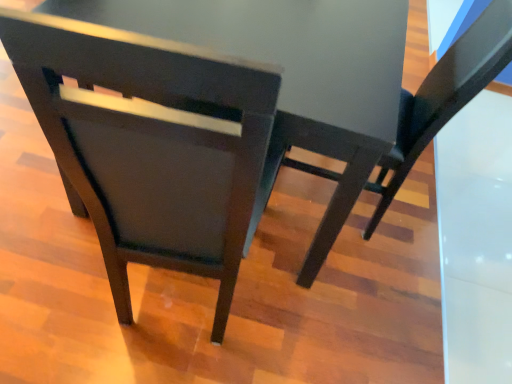
Locate an element on the screen. The width and height of the screenshot is (512, 384). matte black chair at center, positioned as the second chair in left-to-right order is located at coordinates (444, 97).

What do you see at coordinates (444, 97) in the screenshot? I see `matte black chair at center, acting as the first chair starting from the right` at bounding box center [444, 97].

Describe the element at coordinates (150, 144) in the screenshot. I see `matte black chair at center, which is counted as the 1th chair, starting from the left` at that location.

Where is `matte black chair at center, which is the 2th chair from right to left`? The height and width of the screenshot is (384, 512). matte black chair at center, which is the 2th chair from right to left is located at coordinates (150, 144).

Identify the location of matte black chair at center, acting as the first chair starting from the right. (444, 97).

Considering the positions of objects matte black chair at center, which is the 2th chair from right to left, and matte black chair at center, acting as the first chair starting from the right, in the image provided, who is more to the right, matte black chair at center, which is the 2th chair from right to left, or matte black chair at center, acting as the first chair starting from the right,?

Positioned to the right is matte black chair at center, acting as the first chair starting from the right.

Is the position of matte black chair at center, which is the 2th chair from right to left, less distant than that of matte black chair at center, acting as the first chair starting from the right?

Yes, the depth of matte black chair at center, which is the 2th chair from right to left, is less than that of matte black chair at center, acting as the first chair starting from the right.

Does point (132, 248) come behind point (407, 141)?

No, it is in front of (407, 141).

From the image's perspective, is matte black chair at center, which is counted as the 1th chair, starting from the left, positioned above or below matte black chair at center, positioned as the second chair in left-to-right order?

From the image's perspective, matte black chair at center, which is counted as the 1th chair, starting from the left, appears below matte black chair at center, positioned as the second chair in left-to-right order.

From a real-world perspective, is matte black chair at center, which is the 2th chair from right to left, above or below matte black chair at center, acting as the first chair starting from the right?

In terms of real-world spatial position, matte black chair at center, which is the 2th chair from right to left, is above matte black chair at center, acting as the first chair starting from the right.

Which of these two, matte black chair at center, which is the 2th chair from right to left, or matte black chair at center, positioned as the second chair in left-to-right order, is wider?

matte black chair at center, positioned as the second chair in left-to-right order, is wider.

Who is shorter, matte black chair at center, which is the 2th chair from right to left, or matte black chair at center, positioned as the second chair in left-to-right order?

matte black chair at center, positioned as the second chair in left-to-right order, is shorter.

Is matte black chair at center, which is counted as the 1th chair, starting from the left, bigger or smaller than matte black chair at center, positioned as the second chair in left-to-right order?

matte black chair at center, which is counted as the 1th chair, starting from the left, is bigger than matte black chair at center, positioned as the second chair in left-to-right order.

Do you think matte black chair at center, which is the 2th chair from right to left, is within matte black chair at center, acting as the first chair starting from the right, or outside of it?

matte black chair at center, which is the 2th chair from right to left, cannot be found inside matte black chair at center, acting as the first chair starting from the right.

Is matte black chair at center, which is counted as the 1th chair, starting from the left, not close to matte black chair at center, positioned as the second chair in left-to-right order?

No, there isn't a large distance between matte black chair at center, which is counted as the 1th chair, starting from the left, and matte black chair at center, positioned as the second chair in left-to-right order.

Is matte black chair at center, which is the 2th chair from right to left, turned away from matte black chair at center, acting as the first chair starting from the right?

matte black chair at center, which is the 2th chair from right to left, does not have its back to matte black chair at center, acting as the first chair starting from the right.

This screenshot has width=512, height=384. Find the location of `chair directly beneath the matte black chair at center, which is the 2th chair from right to left (from a real-world perspective)`. chair directly beneath the matte black chair at center, which is the 2th chair from right to left (from a real-world perspective) is located at coordinates (444, 97).

Does matte black chair at center, acting as the first chair starting from the right, appear on the right side of matte black chair at center, which is counted as the 1th chair, starting from the left?

Yes.

Is the depth of matte black chair at center, acting as the first chair starting from the right, less than that of matte black chair at center, which is the 2th chair from right to left?

No, matte black chair at center, acting as the first chair starting from the right, is further to the viewer.

Between point (445, 69) and point (60, 44), which one is positioned behind?

The point (445, 69) is farther from the camera.

From the image's perspective, which object appears higher, matte black chair at center, positioned as the second chair in left-to-right order, or matte black chair at center, which is the 2th chair from right to left?

matte black chair at center, positioned as the second chair in left-to-right order, is shown above in the image.

In the scene shown: From a real-world perspective, who is located lower, matte black chair at center, positioned as the second chair in left-to-right order, or matte black chair at center, which is the 2th chair from right to left?

From a 3D spatial view, matte black chair at center, positioned as the second chair in left-to-right order, is below.

In terms of width, does matte black chair at center, positioned as the second chair in left-to-right order, look wider or thinner when compared to matte black chair at center, which is the 2th chair from right to left?

Considering their sizes, matte black chair at center, positioned as the second chair in left-to-right order, looks broader than matte black chair at center, which is the 2th chair from right to left.

Who is taller, matte black chair at center, acting as the first chair starting from the right, or matte black chair at center, which is the 2th chair from right to left?

Standing taller between the two is matte black chair at center, which is the 2th chair from right to left.

Looking at the image, does matte black chair at center, acting as the first chair starting from the right, seem bigger or smaller compared to matte black chair at center, which is counted as the 1th chair, starting from the left?

matte black chair at center, acting as the first chair starting from the right, is smaller than matte black chair at center, which is counted as the 1th chair, starting from the left.

Is matte black chair at center, positioned as the second chair in left-to-right order, inside or outside of matte black chair at center, which is counted as the 1th chair, starting from the left?

matte black chair at center, positioned as the second chair in left-to-right order, cannot be found inside matte black chair at center, which is counted as the 1th chair, starting from the left.

Are matte black chair at center, positioned as the second chair in left-to-right order, and matte black chair at center, which is counted as the 1th chair, starting from the left, far apart?

No.

Is matte black chair at center, positioned as the second chair in left-to-right order, turned away from matte black chair at center, which is the 2th chair from right to left?

matte black chair at center, positioned as the second chair in left-to-right order, does not have its back to matte black chair at center, which is the 2th chair from right to left.

How many degrees apart are the facing directions of matte black chair at center, positioned as the second chair in left-to-right order, and matte black chair at center, which is the 2th chair from right to left?

matte black chair at center, positioned as the second chair in left-to-right order, and matte black chair at center, which is the 2th chair from right to left, are facing 87.2 degrees away from each other.

The width and height of the screenshot is (512, 384). Find the location of `chair that appears on the right of matte black chair at center, which is counted as the 1th chair, starting from the left`. chair that appears on the right of matte black chair at center, which is counted as the 1th chair, starting from the left is located at coordinates (444, 97).

At what (x,y) coordinates should I click in order to perform the action: click on chair that is above the matte black chair at center, positioned as the second chair in left-to-right order (from a real-world perspective). Please return your answer as a coordinate pair (x, y). This screenshot has width=512, height=384. Looking at the image, I should click on (150, 144).

Find the location of `chair located on the left of matte black chair at center, acting as the first chair starting from the right`. chair located on the left of matte black chair at center, acting as the first chair starting from the right is located at coordinates (150, 144).